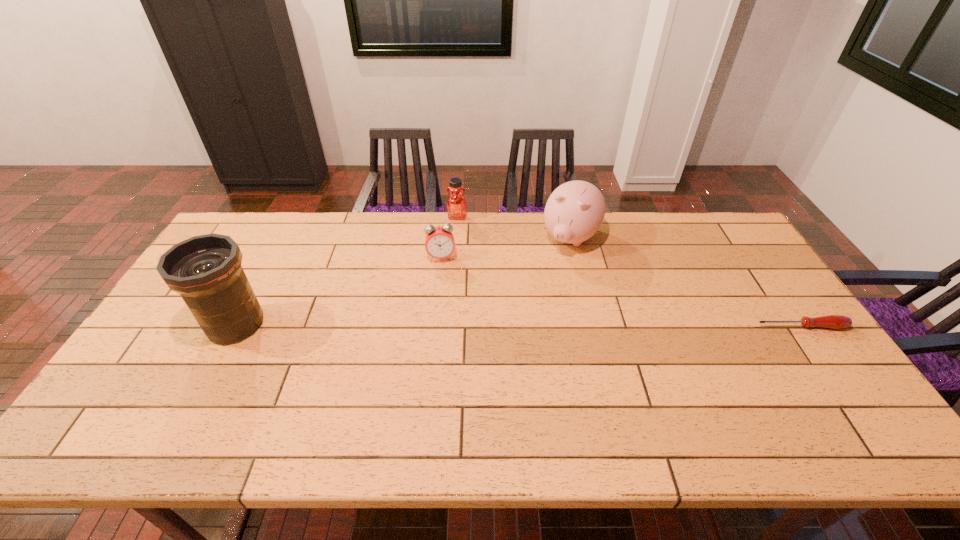
This screenshot has height=540, width=960. I want to click on vacant space that's between the shortest object and the telephoto lens, so click(x=518, y=326).

Find the location of a particular element. free space between the second shortest object and the leftmost object is located at coordinates (338, 291).

Identify the location of free space between the fourth tallest object and the fourth object from left to right. point(506,248).

At what (x,y) coordinates should I click in order to perform the action: click on empty space between the telephoto lens and the rightmost object. Please return your answer as a coordinate pair (x, y). This screenshot has width=960, height=540. Looking at the image, I should click on (518, 326).

You are a GUI agent. You are given a task and a screenshot of the screen. Output one action in this format:
    pyautogui.click(x=<x>, y=<y>)
    Task: Click on the free spot between the alarm clock and the telephoto lens
    The height and width of the screenshot is (540, 960).
    Given the screenshot: What is the action you would take?
    pyautogui.click(x=338, y=291)

The width and height of the screenshot is (960, 540). In order to click on vacant area that lies between the alarm clock and the second tallest object in this screenshot , I will do click(506, 248).

At what (x,y) coordinates should I click in order to perform the action: click on empty location between the leftmost object and the fourth tallest object. Please return your answer as a coordinate pair (x, y). The height and width of the screenshot is (540, 960). Looking at the image, I should click on (338, 291).

Locate an element on the screen. This screenshot has width=960, height=540. empty space that is in between the rightmost object and the alarm clock is located at coordinates (621, 292).

Where is `object that ranks as the fourth closest to the honey`? object that ranks as the fourth closest to the honey is located at coordinates (831, 321).

Identify which object is the closest to the rightmost object. Please provide its 2D coordinates. Your answer should be formatted as a tuple, i.e. [(x, y)], where the tuple contains the x and y coordinates of a point satisfying the conditions above.

[(575, 210)]